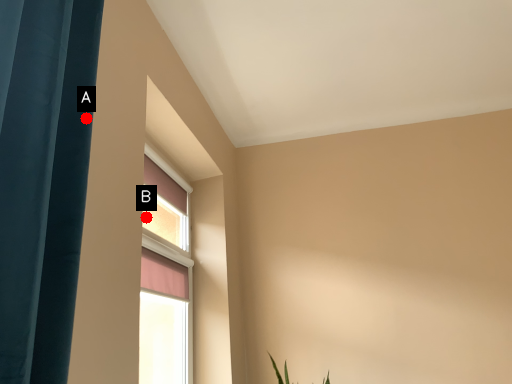
Question: Two points are circled on the image, labeled by A and B beside each circle. Among these points, which one is nearest to the camera?

Choices:
 (A) A is closer
 (B) B is closer

Answer: (A)